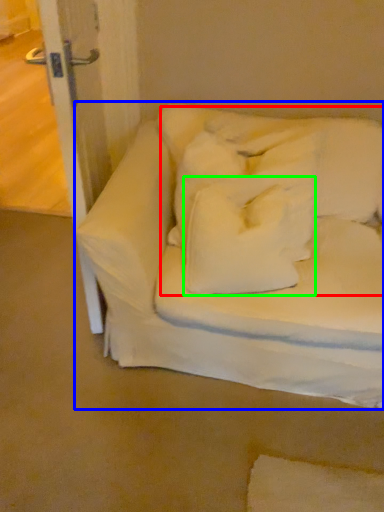
Question: Which object is the farthest from bedding (highlighted by a red box)? Choose among these: furniture (highlighted by a blue box) or pillow (highlighted by a green box).

Choices:
 (A) furniture
 (B) pillow

Answer: (A)